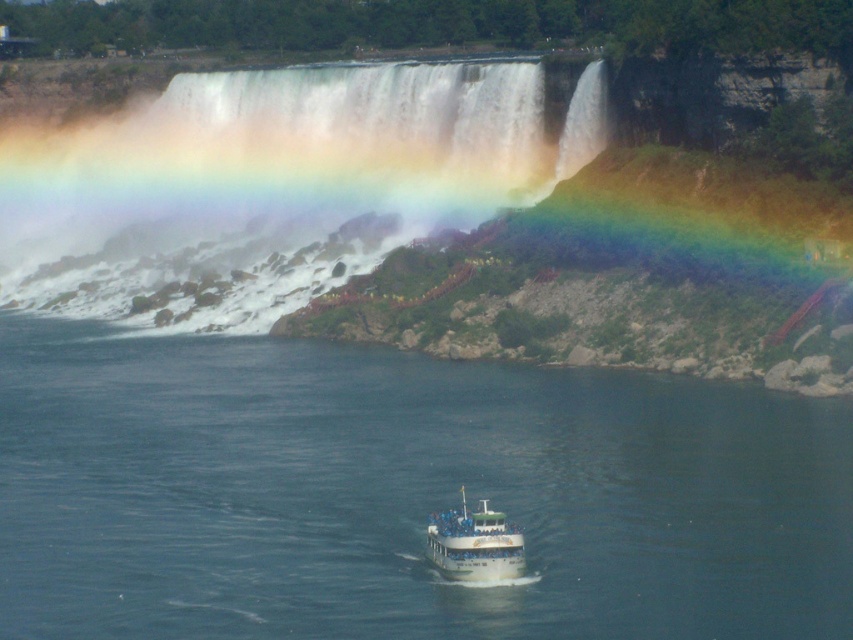
Question: Observing the image, what is the correct spatial positioning of white misty waterfall at upper center in reference to white glossy boat at center?

Choices:
 (A) right
 (B) left

Answer: (B)

Question: Among these points, which one is nearest to the camera?

Choices:
 (A) (440, 548)
 (B) (10, 227)
 (C) (669, 388)

Answer: (A)

Question: Is white misty waterfall at upper center further to the viewer compared to white glossy boat at center?

Choices:
 (A) no
 (B) yes

Answer: (B)

Question: Can you confirm if clear blue water at center is thinner than white glossy boat at center?

Choices:
 (A) no
 (B) yes

Answer: (A)

Question: Which is nearer to the white misty waterfall at upper center?

Choices:
 (A) clear blue water at center
 (B) white glossy boat at center

Answer: (A)

Question: Which of these objects is positioned farthest from the white glossy boat at center?

Choices:
 (A) white misty waterfall at upper center
 (B) clear blue water at center

Answer: (A)